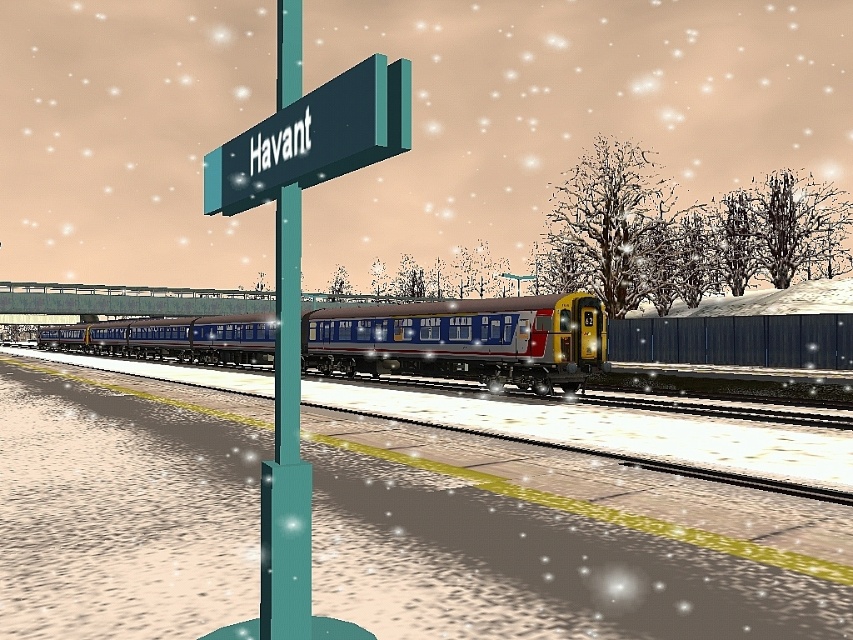
Between metallic blue train at center and green matte signboard at upper center, which one appears on the left side from the viewer's perspective?

From the viewer's perspective, metallic blue train at center appears more on the left side.

Does metallic blue train at center have a larger size compared to green matte signboard at upper center?

Yes, metallic blue train at center is bigger than green matte signboard at upper center.

The image size is (853, 640). Describe the element at coordinates (463, 340) in the screenshot. I see `metallic blue train at center` at that location.

Where is `metallic blue train at center`? metallic blue train at center is located at coordinates (463, 340).

Is teal glossy signpost at center further to camera compared to green matte signboard at upper center?

Yes, teal glossy signpost at center is further from the viewer.

Is teal glossy signpost at center shorter than green matte signboard at upper center?

In fact, teal glossy signpost at center may be taller than green matte signboard at upper center.

Is point (306, 538) farther from viewer compared to point (286, 157)?

Yes, it is.

Where is `teal glossy signpost at center`? Image resolution: width=853 pixels, height=640 pixels. teal glossy signpost at center is located at coordinates (286, 452).

Can you confirm if metallic blue train at center is positioned above teal glossy signpost at center?

No, metallic blue train at center is not above teal glossy signpost at center.

Can you confirm if metallic blue train at center is wider than teal glossy signpost at center?

Yes, metallic blue train at center is wider than teal glossy signpost at center.

Describe the element at coordinates (463, 340) in the screenshot. I see `metallic blue train at center` at that location.

I want to click on metallic blue train at center, so click(x=463, y=340).